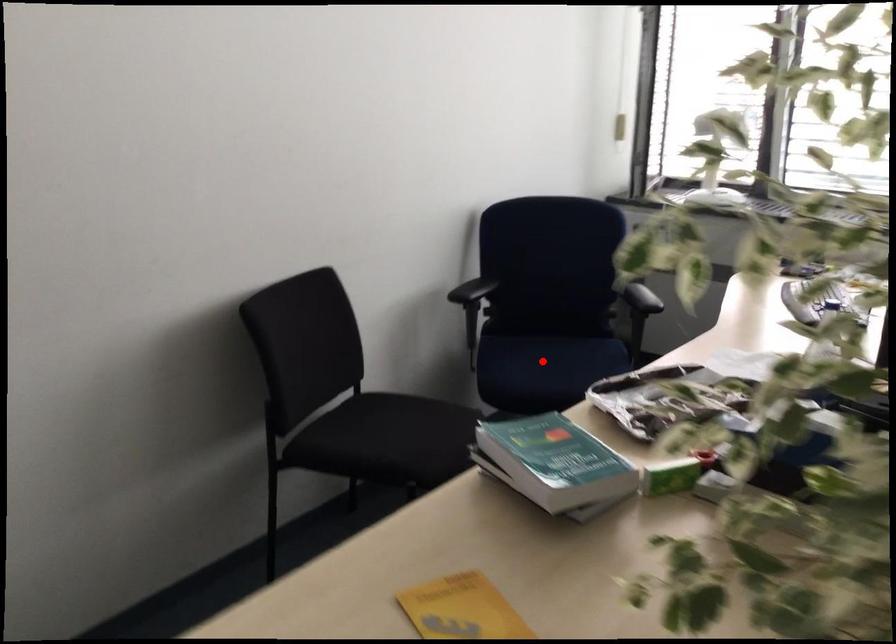
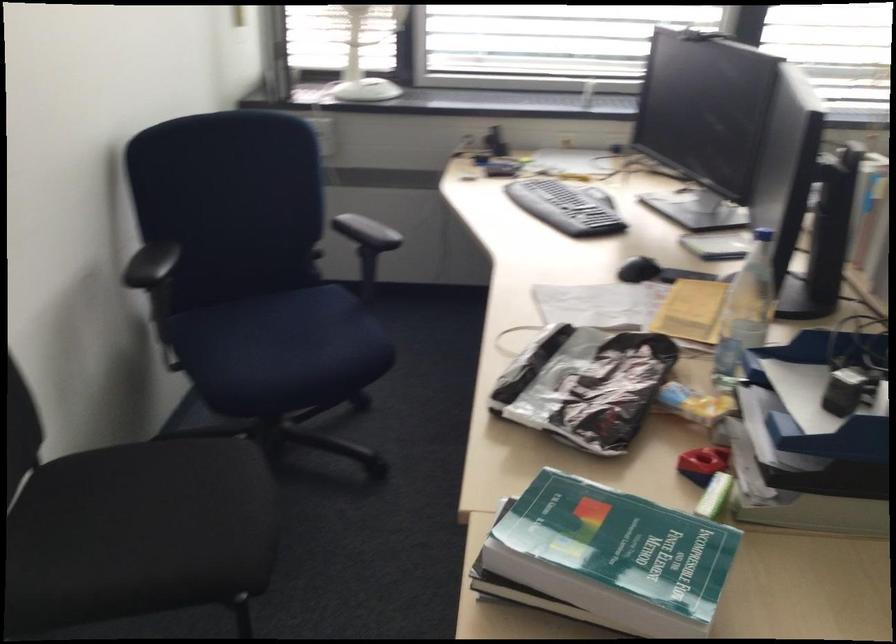
The point at the highlighted location is marked in the first image. Where is the corresponding point in the second image?

(278, 346)